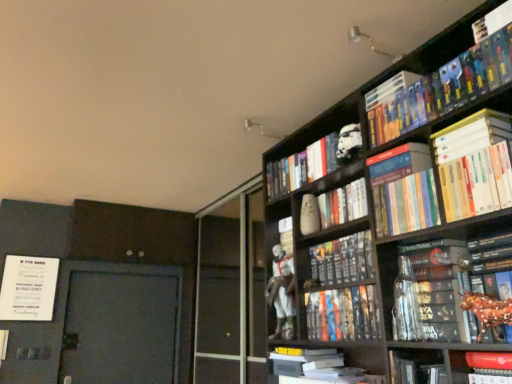
Question: Does shiny metallic horse at right, which ranks as the 8th book in top-to-bottom order, have a lesser height compared to white matte vase at upper center, the 2th toy in the right-to-left sequence?

Choices:
 (A) no
 (B) yes

Answer: (B)

Question: Considering the relative sizes of shiny metallic horse at right, which ranks as the 8th book in top-to-bottom order, and white matte vase at upper center, which is the 1th toy in back-to-front order, in the image provided, is shiny metallic horse at right, which ranks as the 8th book in top-to-bottom order, wider than white matte vase at upper center, which is the 1th toy in back-to-front order,?

Choices:
 (A) no
 (B) yes

Answer: (B)

Question: Is white matte vase at upper center, the 1th toy viewed from the left, completely or partially inside shiny metallic horse at right, placed as the fifth book when sorted from bottom to top?

Choices:
 (A) no
 (B) yes

Answer: (A)

Question: Is shiny metallic horse at right, which ranks as the 8th book in top-to-bottom order, facing away from white matte vase at upper center, which appears as the 2th toy when viewed from the top?

Choices:
 (A) no
 (B) yes

Answer: (A)

Question: Can you confirm if shiny metallic horse at right, placed as the fifth book when sorted from bottom to top, is positioned to the left of white matte vase at upper center, which is the 1th toy in back-to-front order?

Choices:
 (A) no
 (B) yes

Answer: (A)

Question: Could you tell me if shiny metallic horse at right, placed as the fifth book when sorted from bottom to top, is turned towards white matte vase at upper center, the 1th toy viewed from the left?

Choices:
 (A) no
 (B) yes

Answer: (A)

Question: Is white matte book at upper right, which is the third book from top to bottom, at the right side of white matte book at lower center, the 1th book from the bottom?

Choices:
 (A) yes
 (B) no

Answer: (A)

Question: Is white matte book at upper right, which is the third book from top to bottom, facing away from white matte book at lower center, acting as the 12th book starting from the top?

Choices:
 (A) yes
 (B) no

Answer: (B)

Question: Is white matte book at upper right, which is the third book from top to bottom, far from white matte book at lower center, the 1th book from the bottom?

Choices:
 (A) no
 (B) yes

Answer: (A)

Question: Is white matte book at upper right, the 10th book in the bottom-to-top sequence, bigger than white matte book at lower center, the 1th book from the bottom?

Choices:
 (A) yes
 (B) no

Answer: (B)

Question: Is white matte book at upper right, which is the third book from top to bottom, thinner than white matte book at lower center, the 1th book from the bottom?

Choices:
 (A) no
 (B) yes

Answer: (B)

Question: From a real-world perspective, does white matte book at upper right, which is the third book from top to bottom, sit lower than white matte book at lower center, acting as the 12th book starting from the top?

Choices:
 (A) yes
 (B) no

Answer: (B)

Question: Is white matte book at upper right, which is the third book from top to bottom, facing away from hardcover books at upper right, which is the 2th book in top-to-bottom order?

Choices:
 (A) yes
 (B) no

Answer: (B)